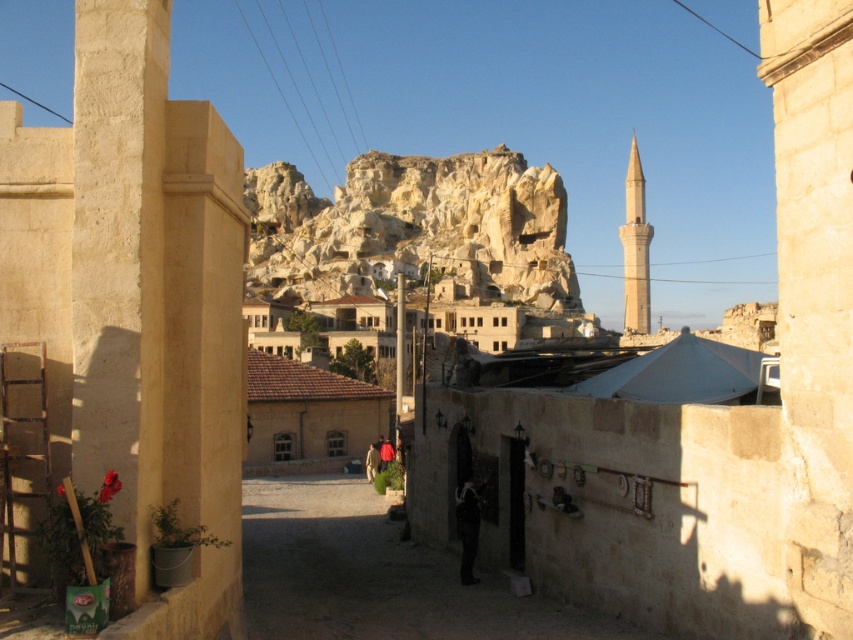
Is smooth stone alley at center wider than smooth beige minaret at center-right?

Incorrect, smooth stone alley at center's width does not surpass smooth beige minaret at center-right's.

Which is more to the right, smooth stone alley at center or smooth beige minaret at center-right?

smooth beige minaret at center-right

Is point (351, 547) more distant than point (625, 259)?

No, it is in front of (625, 259).

The width and height of the screenshot is (853, 640). Find the location of `smooth stone alley at center`. smooth stone alley at center is located at coordinates (375, 576).

Between beige stone pillar at left and smooth stone alley at center, which one is positioned lower?

Positioned lower is smooth stone alley at center.

Between beige stone pillar at left and smooth stone alley at center, which one is positioned higher?

beige stone pillar at left is higher up.

Is point (114, 278) in front of point (344, 486)?

That is True.

Identify the location of beige stone pillar at left. Image resolution: width=853 pixels, height=640 pixels. (119, 253).

Which is below, beige stone pillar at left or light beige rock formation at center?

beige stone pillar at left is lower down.

Between beige stone pillar at left and light beige rock formation at center, which one has more height?

light beige rock formation at center is taller.

The image size is (853, 640). I want to click on beige stone pillar at left, so click(x=119, y=253).

Locate an element on the screen. This screenshot has height=640, width=853. beige stone pillar at left is located at coordinates (119, 253).